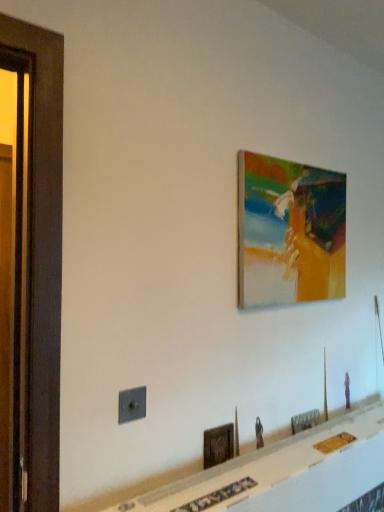
Question: Considering the positions of metallic gray outlet at lower left and wooden picture frame at lower center, placed as the second picture frame when sorted from top to bottom, in the image, is metallic gray outlet at lower left taller or shorter than wooden picture frame at lower center, placed as the second picture frame when sorted from top to bottom,?

Choices:
 (A) tall
 (B) short

Answer: (B)

Question: Is point (142, 413) positioned closer to the camera than point (210, 439)?

Choices:
 (A) farther
 (B) closer

Answer: (B)

Question: Estimate the real-world distances between objects in this image. Which object is closer to the wooden screen door at left?

Choices:
 (A) wooden picture frame at lower center, placed as the 3th picture frame when sorted from top to bottom
 (B) matte acrylic painting at upper right, which is the 3th picture frame in bottom-to-top order
 (C) wooden picture frame at lower center, which is the second picture frame in bottom-to-top order
 (D) metallic gray outlet at lower left

Answer: (D)

Question: Estimate the real-world distances between objects in this image. Which object is farther from the wooden screen door at left?

Choices:
 (A) wooden picture frame at lower center, placed as the second picture frame when sorted from top to bottom
 (B) metallic gray outlet at lower left
 (C) wooden picture frame at lower center, the first picture frame when ordered from bottom to top
 (D) matte acrylic painting at upper right, which is the 1th picture frame in top-to-bottom order

Answer: (C)